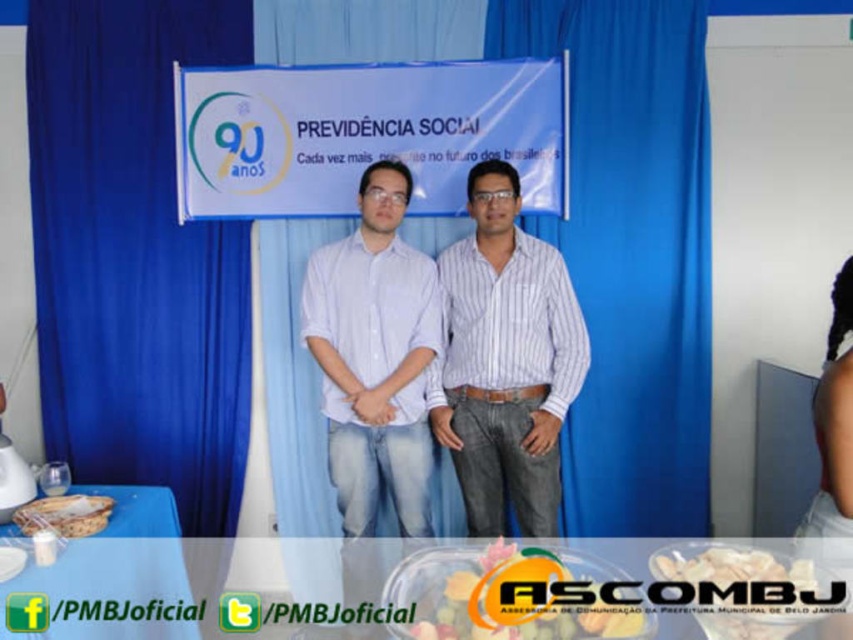
Between white cotton shirt at center and matte brown bread at lower left, which one appears on the right side from the viewer's perspective?

From the viewer's perspective, white cotton shirt at center appears more on the right side.

Locate an element on the screen. The width and height of the screenshot is (853, 640). white cotton shirt at center is located at coordinates (375, 355).

Does point (466, 268) come closer to viewer compared to point (33, 520)?

No, it is not.

How distant is white striped shirt at center from matte brown bread at lower left?

They are 4.50 feet apart.

Is point (480, 365) less distant than point (59, 506)?

No.

This screenshot has height=640, width=853. Identify the location of white striped shirt at center. (505, 362).

Between blue plastic table at lower left and black fabric hair at lower right, which one has less height?

blue plastic table at lower left is shorter.

Does blue plastic table at lower left appear on the right side of black fabric hair at lower right?

No, blue plastic table at lower left is not to the right of black fabric hair at lower right.

Image resolution: width=853 pixels, height=640 pixels. What do you see at coordinates (114, 576) in the screenshot?
I see `blue plastic table at lower left` at bounding box center [114, 576].

What are the coordinates of `blue plastic table at lower left` in the screenshot? It's located at (114, 576).